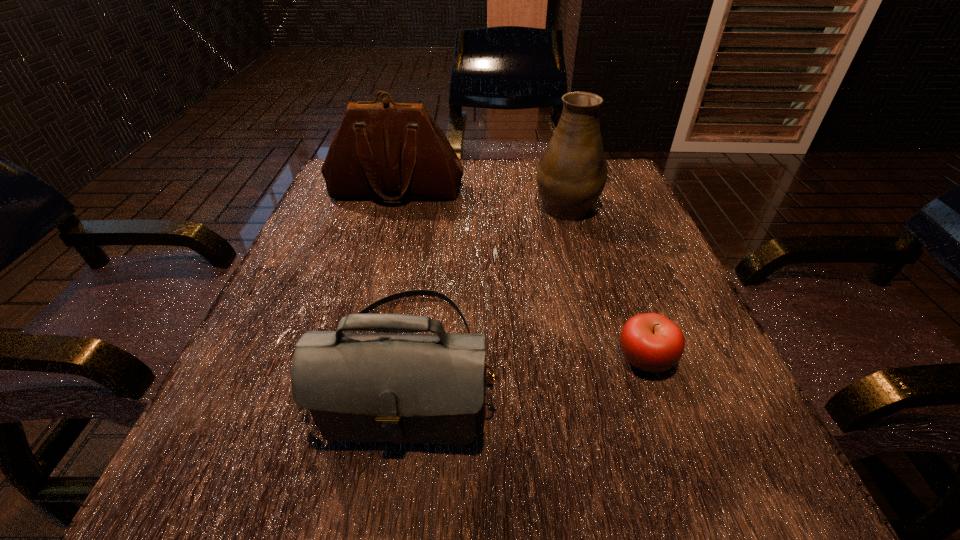
The image size is (960, 540). Find the location of `pitcher`. pitcher is located at coordinates (571, 175).

Locate an element on the screen. the farther shoulder bag is located at coordinates pos(391,151).

This screenshot has height=540, width=960. Find the location of `the third tallest object`. the third tallest object is located at coordinates (359, 387).

This screenshot has height=540, width=960. Find the location of `the shorter shoulder bag`. the shorter shoulder bag is located at coordinates (359, 387).

Where is `apple`? This screenshot has width=960, height=540. apple is located at coordinates (650, 342).

Locate an element on the screen. This screenshot has height=540, width=960. vacant space located 0.070m on the handle side of the pitcher is located at coordinates (557, 172).

Where is `free space located on the handle side of the pitcher`? The image size is (960, 540). free space located on the handle side of the pitcher is located at coordinates (558, 176).

Where is `free spot located on the handle side of the pitcher`? free spot located on the handle side of the pitcher is located at coordinates tap(555, 165).

At what (x,y) coordinates should I click in order to perform the action: click on free space located on the back of the taller shoulder bag. Please return your answer as a coordinate pair (x, y). Looking at the image, I should click on (404, 162).

Find the location of a particular element. vacant space located 0.100m on the left of the nearer shoulder bag is located at coordinates (252, 365).